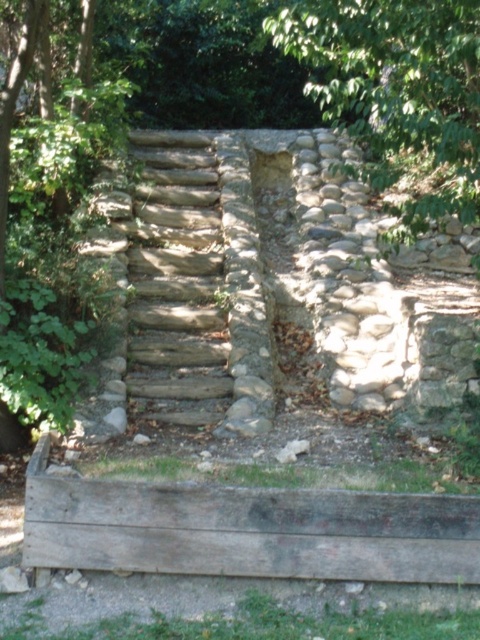
Between green leafy tree at upper center and natural stone stairs at center, which one is positioned higher?

green leafy tree at upper center

Is green leafy tree at upper center positioned at the back of natural stone stairs at center?

No.

Does point (447, 76) come closer to viewer compared to point (145, 321)?

Yes, it is.

Where is `green leafy tree at upper center`? The image size is (480, 640). green leafy tree at upper center is located at coordinates (397, 93).

Between weathered wood at lower center and green leafy tree at upper center, which one is positioned higher?

green leafy tree at upper center

This screenshot has height=640, width=480. Describe the element at coordinates (247, 531) in the screenshot. I see `weathered wood at lower center` at that location.

I want to click on weathered wood at lower center, so click(247, 531).

Is weathered wood at lower center to the left of natural stone stairs at center from the viewer's perspective?

In fact, weathered wood at lower center is to the right of natural stone stairs at center.

Is weathered wood at lower center bigger than natural stone stairs at center?

Actually, weathered wood at lower center might be smaller than natural stone stairs at center.

Between point (44, 442) and point (137, 300), which one is positioned in front?

Point (44, 442)

Find the location of a particular element. weathered wood at lower center is located at coordinates (247, 531).